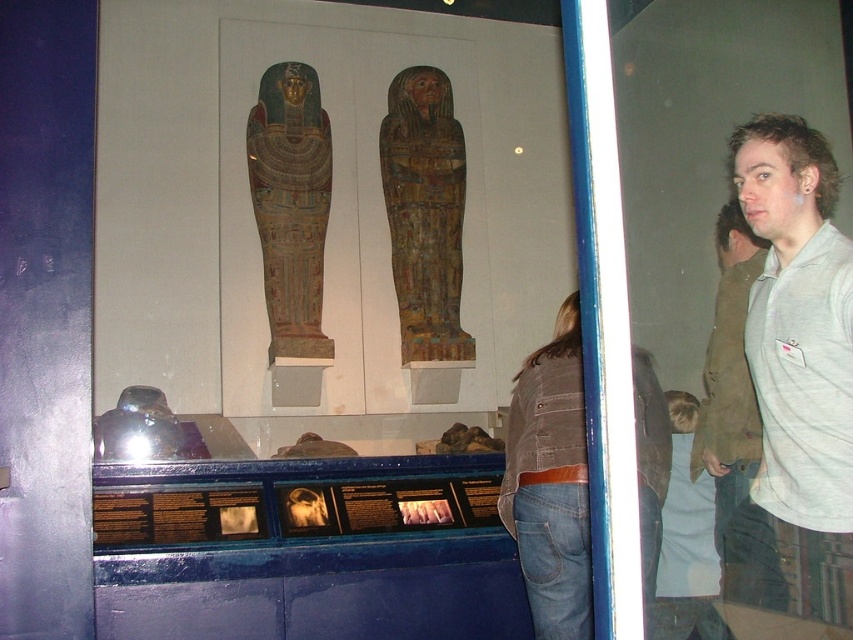
Question: Can you confirm if gray cotton shirt at right is thinner than gray cotton sweatshirt at right?

Choices:
 (A) yes
 (B) no

Answer: (B)

Question: Which object appears farthest from the camera in this image?

Choices:
 (A) polychrome painted sarcophagus at center
 (B) wooden painted sarcophagus at center
 (C) light gray shirt at right

Answer: (B)

Question: Considering the relative positions of gray cotton shirt at right and gray cotton sweatshirt at right in the image provided, where is gray cotton shirt at right located with respect to gray cotton sweatshirt at right?

Choices:
 (A) left
 (B) right

Answer: (B)

Question: Among these objects, which one is nearest to the camera?

Choices:
 (A) light gray shirt at right
 (B) brown denim jacket at lower right
 (C) gray cotton sweatshirt at right
 (D) wooden painted sarcophagus at center

Answer: (A)

Question: Observing the image, what is the correct spatial positioning of brown denim jacket at lower right in reference to gray cotton sweatshirt at right?

Choices:
 (A) below
 (B) above

Answer: (A)

Question: Which of these objects is positioned farthest from the brown denim jacket at lower right?

Choices:
 (A) polychrome painted sarcophagus at center
 (B) gray cotton sweatshirt at right

Answer: (A)